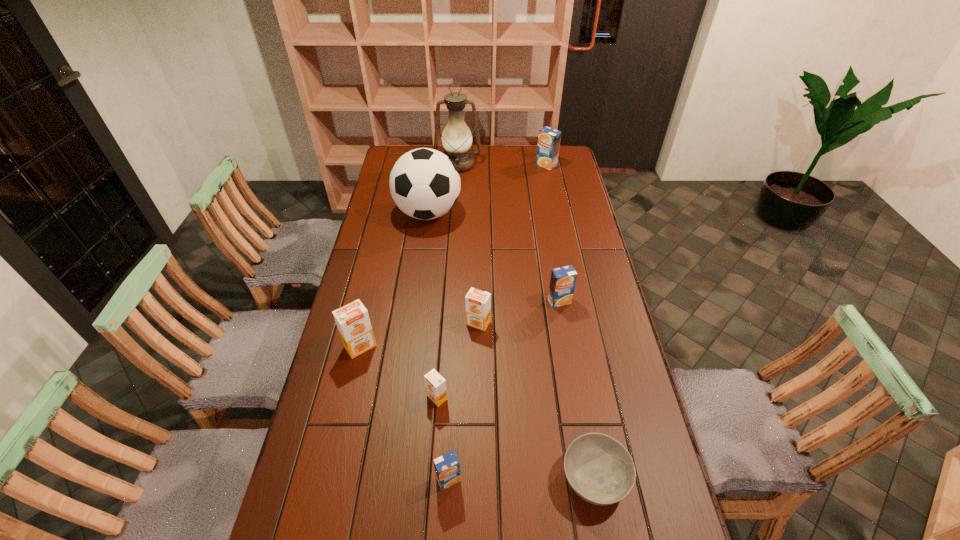
Identify the location of the farthest orange orange juice. (478, 303).

The image size is (960, 540). Find the location of `the smallest blue orange_juice`. the smallest blue orange_juice is located at coordinates (447, 467).

Locate an element on the screen. the nearest orange juice is located at coordinates (447, 467).

Locate an element on the screen. The height and width of the screenshot is (540, 960). the nearest orange orange juice is located at coordinates (435, 384).

The width and height of the screenshot is (960, 540). Find the location of `the second orange orange juice from right to left`. the second orange orange juice from right to left is located at coordinates (435, 384).

Image resolution: width=960 pixels, height=540 pixels. Identify the location of bowl. (600, 470).

You are a GUI agent. You are given a task and a screenshot of the screen. Output one action in this format:
    pyautogui.click(x=<x>, y=<y>)
    Task: Click on the free spot located on the front of the tallest object
    The image size is (960, 540).
    Given the screenshot: What is the action you would take?
    pyautogui.click(x=454, y=228)

Find the location of a particular element. vacant position located on the right of the soccer ball is located at coordinates coord(508,213).

Find the location of a particular element. This screenshot has height=540, width=960. vacant space located 0.310m on the left of the farthest orange juice is located at coordinates (472, 165).

At what (x,y) coordinates should I click in order to perform the action: click on free space located 0.400m on the right of the second nearest orange orange juice. Please return your answer as a coordinate pair (x, y). This screenshot has height=540, width=960. Looking at the image, I should click on (503, 346).